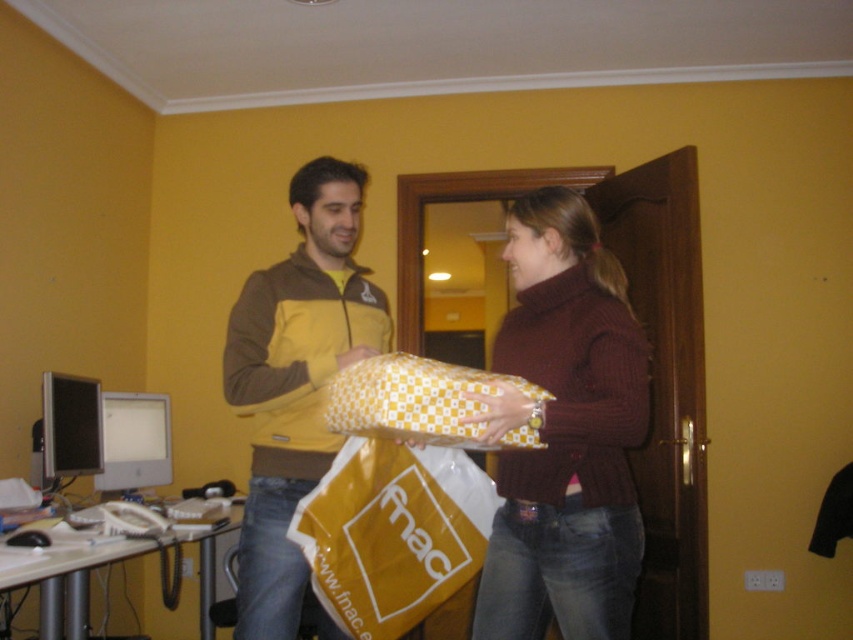
Question: Is knitted maroon sweater at center wider than yellow matte jacket at center?

Choices:
 (A) yes
 (B) no

Answer: (A)

Question: Can you confirm if knitted maroon sweater at center is wider than yellow matte jacket at center?

Choices:
 (A) no
 (B) yes

Answer: (B)

Question: Is knitted maroon sweater at center smaller than yellow paper shopping bag at center?

Choices:
 (A) no
 (B) yes

Answer: (A)

Question: Which of these objects is positioned farthest from the knitted maroon sweater at center?

Choices:
 (A) yellow checkered fabric at center
 (B) yellow paper shopping bag at center

Answer: (B)

Question: Which of the following is the farthest from the observer?

Choices:
 (A) (242, 589)
 (B) (599, 428)
 (C) (328, 552)

Answer: (A)

Question: Which object is closer to the camera taking this photo?

Choices:
 (A) yellow checkered paper at center
 (B) yellow checkered fabric at center

Answer: (B)